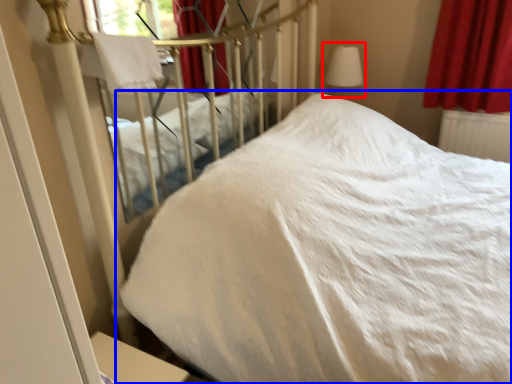
Question: Among these objects, which one is farthest to the camera, table lamp (highlighted by a red box) or bed (highlighted by a blue box)?

Choices:
 (A) table lamp
 (B) bed

Answer: (A)